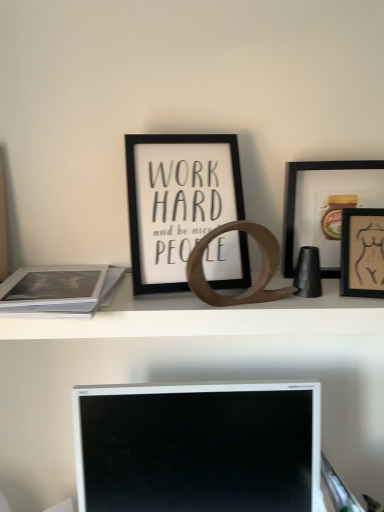
Question: Is white matte paper at left looking in the opposite direction of white glossy computer monitor at center?

Choices:
 (A) no
 (B) yes

Answer: (A)

Question: Does white matte paper at left appear on the left side of white glossy computer monitor at center?

Choices:
 (A) no
 (B) yes

Answer: (B)

Question: Considering the relative sizes of white matte paper at left and white glossy computer monitor at center in the image provided, is white matte paper at left bigger than white glossy computer monitor at center?

Choices:
 (A) yes
 (B) no

Answer: (B)

Question: Is white matte paper at left smaller than white glossy computer monitor at center?

Choices:
 (A) yes
 (B) no

Answer: (A)

Question: Is white matte paper at left not inside white glossy computer monitor at center?

Choices:
 (A) yes
 (B) no

Answer: (A)

Question: Considering the positions of wooden ring at center and white glossy computer monitor at center in the image, is wooden ring at center bigger or smaller than white glossy computer monitor at center?

Choices:
 (A) small
 (B) big

Answer: (A)

Question: From a real-world perspective, is wooden ring at center above or below white glossy computer monitor at center?

Choices:
 (A) below
 (B) above

Answer: (B)

Question: Relative to white glossy computer monitor at center, is wooden ring at center in front or behind?

Choices:
 (A) behind
 (B) front

Answer: (B)

Question: Visually, is wooden ring at center positioned to the left or to the right of white glossy computer monitor at center?

Choices:
 (A) left
 (B) right

Answer: (A)

Question: From a real-world perspective, is black matte picture frame at center, which appears as the first picture frame when viewed from the left, physically located above or below white matte paper at left?

Choices:
 (A) above
 (B) below

Answer: (A)

Question: Choose the correct answer: Is black matte picture frame at center, the 3th picture frame from the right, inside white matte paper at left or outside it?

Choices:
 (A) outside
 (B) inside

Answer: (A)

Question: Considering their positions, is black matte picture frame at center, the 3th picture frame from the right, located in front of or behind white matte paper at left?

Choices:
 (A) front
 (B) behind

Answer: (B)

Question: Considering the positions of black matte picture frame at center, which appears as the first picture frame when viewed from the left, and white matte paper at left in the image, is black matte picture frame at center, which appears as the first picture frame when viewed from the left, bigger or smaller than white matte paper at left?

Choices:
 (A) small
 (B) big

Answer: (B)

Question: From a real-world perspective, is wooden ring at center positioned above or below black matte picture frame at center, the 3th picture frame from the right?

Choices:
 (A) above
 (B) below

Answer: (B)

Question: Considering the relative positions of wooden ring at center and black matte picture frame at center, which appears as the first picture frame when viewed from the left, in the image provided, is wooden ring at center to the left or to the right of black matte picture frame at center, which appears as the first picture frame when viewed from the left,?

Choices:
 (A) right
 (B) left

Answer: (B)